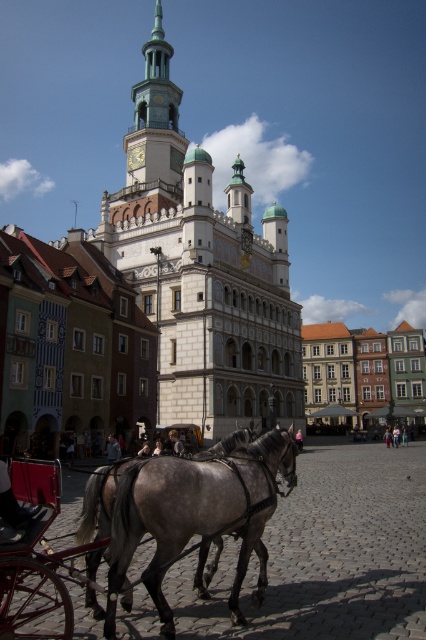
Question: Observing the image, what is the correct spatial positioning of matte orange building at right in reference to light blue fabric at center?

Choices:
 (A) right
 (B) left

Answer: (A)

Question: Which object is farther from the camera taking this photo?

Choices:
 (A) matte orange building at right
 (B) white stone tower at center
 (C) gray matte horse at center
 (D) light brown leather jacket at center

Answer: (A)

Question: Does gray matte horse at center have a lesser width compared to matte orange building at right?

Choices:
 (A) no
 (B) yes

Answer: (B)

Question: Which object is farther from the camera taking this photo?

Choices:
 (A) gray matte horse at center
 (B) light brown leather shoes at lower right

Answer: (B)

Question: Which of the following is the farthest from the observer?

Choices:
 (A) matte orange building at right
 (B) light brown leather shoes at lower right
 (C) gray matte horse at center

Answer: (A)

Question: Considering the relative positions of white stone tower at center and matte orange building at right in the image provided, where is white stone tower at center located with respect to matte orange building at right?

Choices:
 (A) left
 (B) right

Answer: (A)